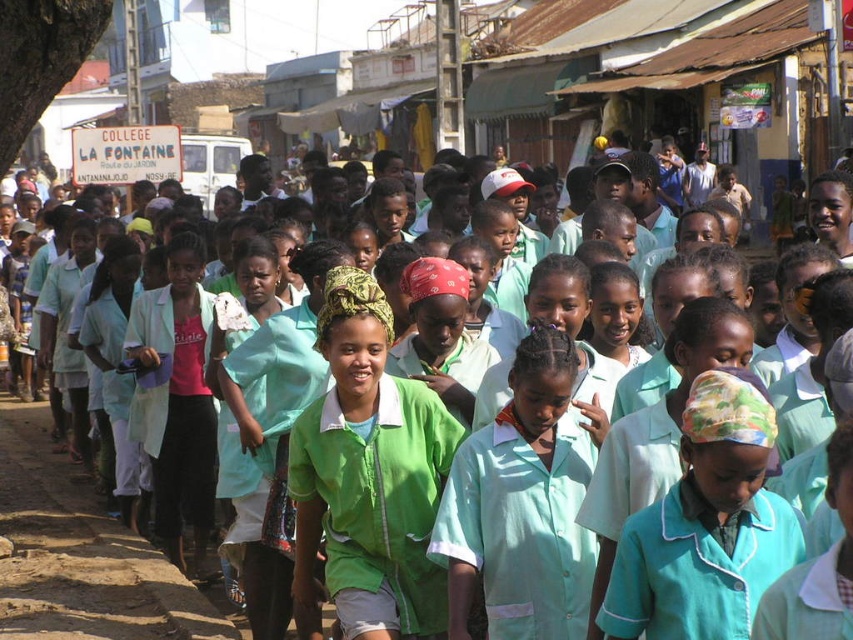
Question: Which object is farther from the camera taking this photo?

Choices:
 (A) green fabric shirt at center
 (B) green fabric headscarf at center

Answer: (A)

Question: Is green fabric shirt at center positioned behind green fabric headscarf at center?

Choices:
 (A) yes
 (B) no

Answer: (A)

Question: Which point is farther to the camera?

Choices:
 (A) (339, 278)
 (B) (734, 396)

Answer: (A)

Question: Does green fabric shirt at center appear over green fabric headscarf at center?

Choices:
 (A) yes
 (B) no

Answer: (A)

Question: Is green fabric shirt at center bigger than green fabric headscarf at center?

Choices:
 (A) yes
 (B) no

Answer: (A)